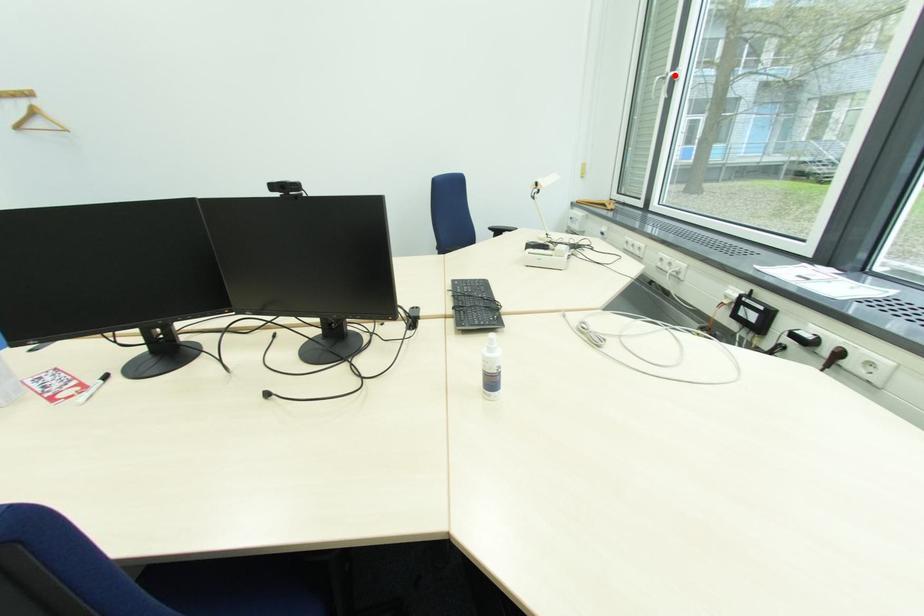
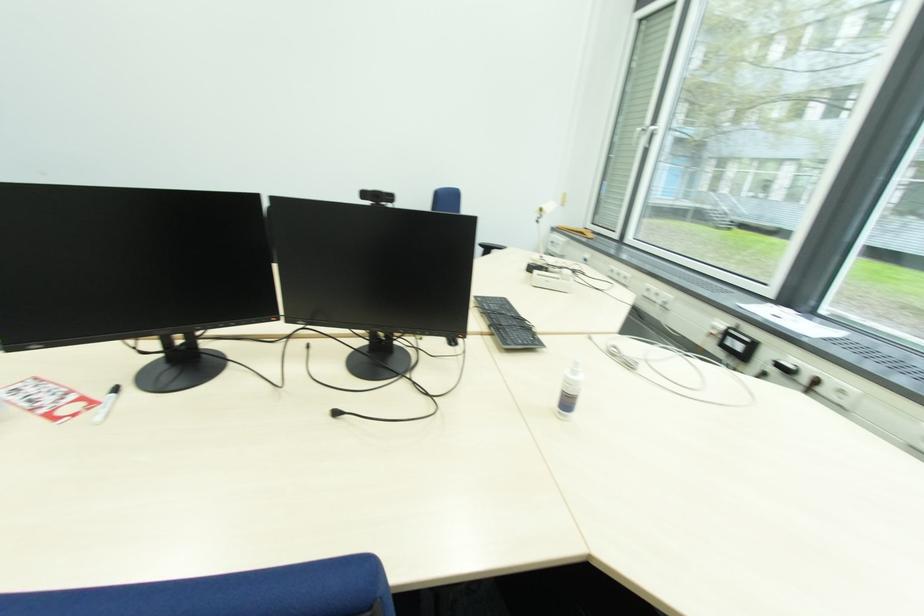
Locate, in the second image, the point that corresponds to the highlighted location in the first image.

(655, 130)